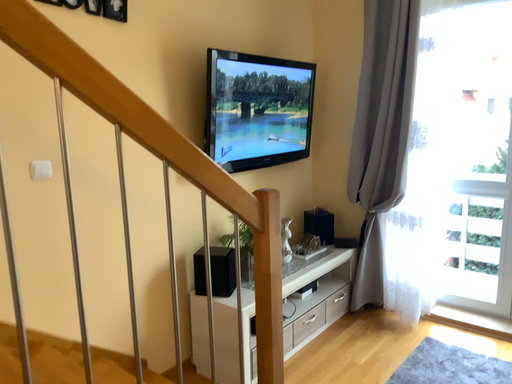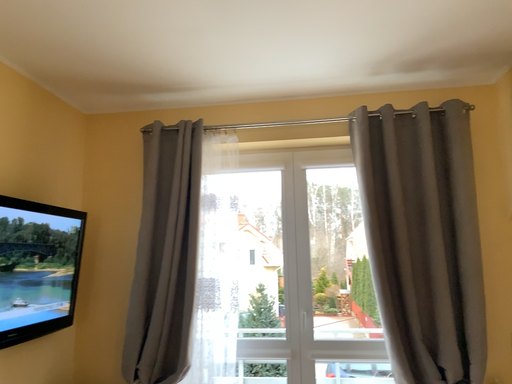
Question: How did the camera likely rotate when shooting the video?

Choices:
 (A) rotated right
 (B) rotated left

Answer: (A)